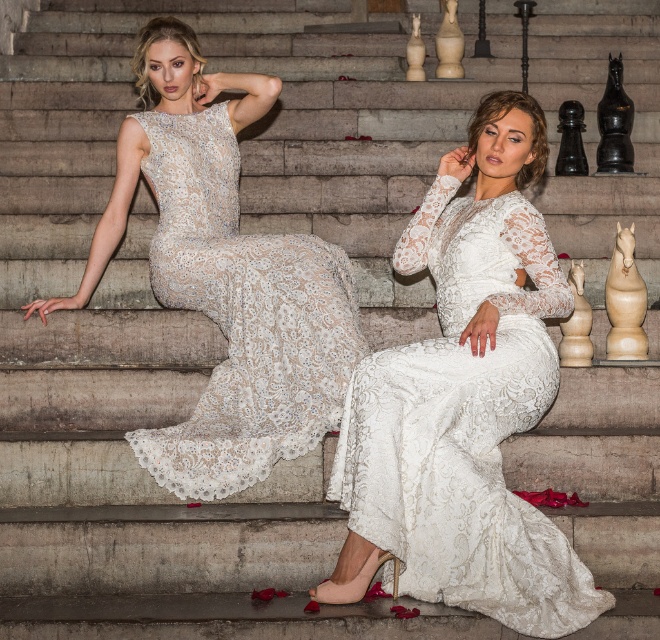
Which is in front, point (529, 426) or point (306, 256)?

Point (529, 426) is more forward.

From the picture: Measure the distance between white lace dress at center and camera.

white lace dress at center and camera are 5.87 meters apart.

Which is in front, point (416, 220) or point (154, 273)?

Positioned in front is point (416, 220).

At what (x,y) coordinates should I click in order to perform the action: click on white lace dress at center. Please return your answer as a coordinate pair (x, y). Looking at the image, I should click on (465, 422).